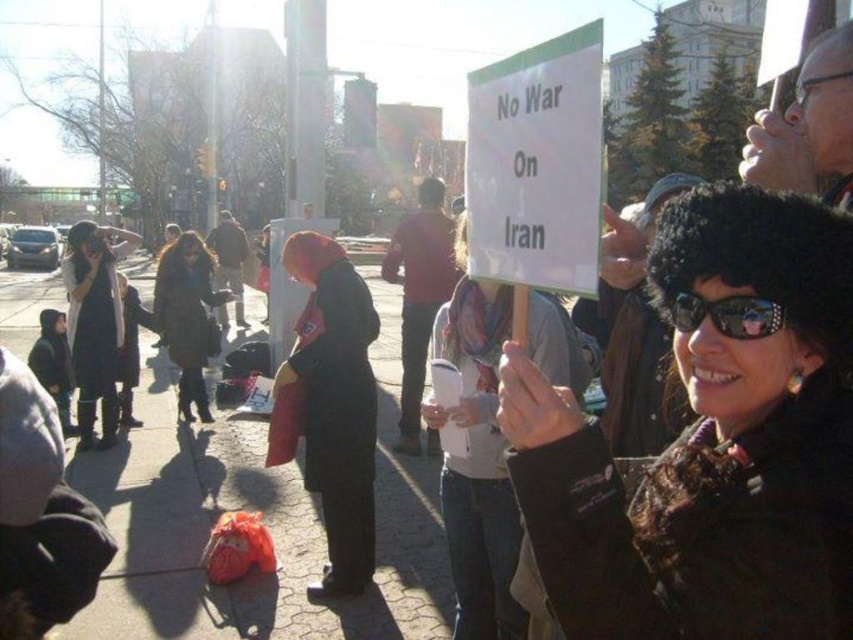
Does white paper sign at center appear on the left side of dark brown leather coat at center?

Incorrect, white paper sign at center is not on the left side of dark brown leather coat at center.

Is point (514, 605) closer to camera compared to point (189, 298)?

Yes, point (514, 605) is in front of point (189, 298).

Is point (473, 442) positioned after point (184, 419)?

No, (473, 442) is closer to viewer.

The image size is (853, 640). Find the location of `white paper sign at center`. white paper sign at center is located at coordinates (477, 464).

Between point (675, 250) and point (467, 435), which one is positioned in front?

Point (675, 250) is in front.

Is point (514, 426) more distant than point (456, 547)?

No.

Locate an element on the screen. The height and width of the screenshot is (640, 853). black fur hat at center is located at coordinates pyautogui.click(x=711, y=445).

Can you confirm if black fur hat at center is thinner than dark brown leather coat at center?

Yes, black fur hat at center is thinner than dark brown leather coat at center.

Does point (666, 241) come closer to viewer compared to point (160, 282)?

Yes, point (666, 241) is in front of point (160, 282).

This screenshot has width=853, height=640. In order to click on black fur hat at center in this screenshot , I will do `click(711, 445)`.